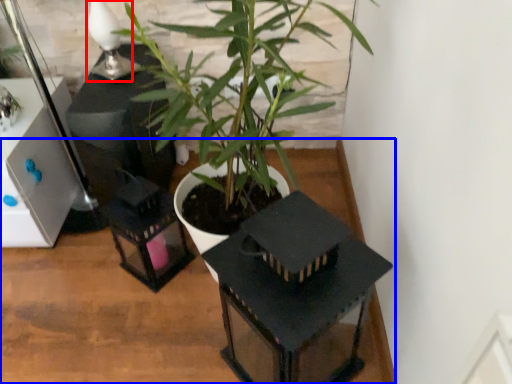
Question: Which object is closer to the camera taking this photo, table lamp (highlighted by a red box) or table (highlighted by a blue box)?

Choices:
 (A) table lamp
 (B) table

Answer: (B)